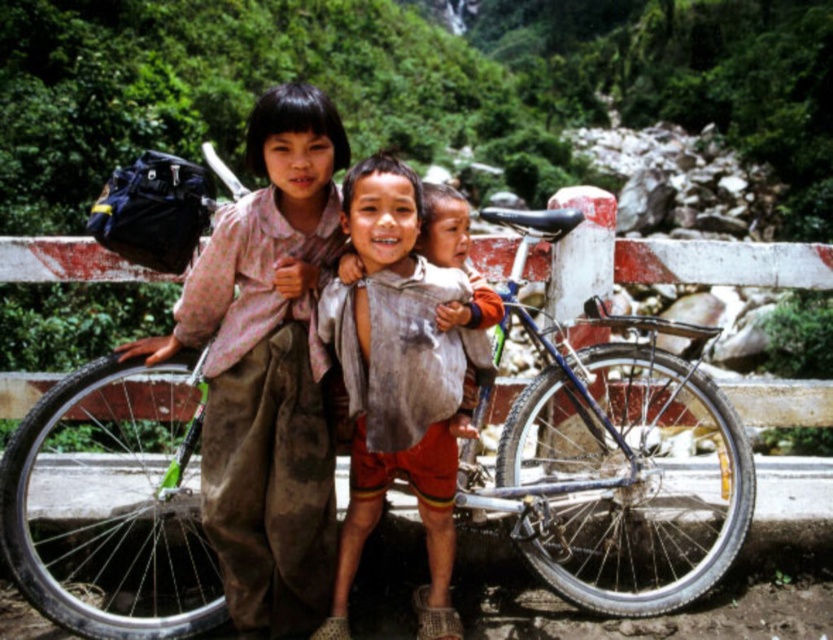
Question: Which point is closer to the camera taking this photo?

Choices:
 (A) (367, 468)
 (B) (494, 298)
 (C) (50, 273)

Answer: (B)

Question: Can you confirm if dusty mud track at lower center is positioned below white painted wood fence at center?

Choices:
 (A) yes
 (B) no

Answer: (A)

Question: Which of the following is the closest to the observer?

Choices:
 (A) white painted wood fence at center
 (B) dusty mud track at lower center

Answer: (B)

Question: Is dirty white shirt at center below white painted wood fence at center?

Choices:
 (A) yes
 (B) no

Answer: (A)

Question: Which point is closer to the camera?

Choices:
 (A) (420, 588)
 (B) (38, 564)
 (C) (318, 433)
 (D) (701, 634)

Answer: (C)

Question: Is blue metallic bicycle at center to the right of dusty mud track at lower center from the viewer's perspective?

Choices:
 (A) yes
 (B) no

Answer: (B)